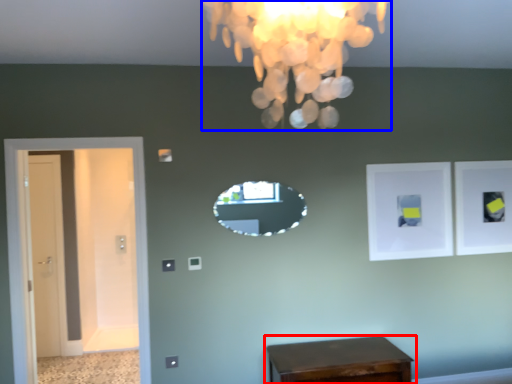
Question: Which object appears farthest to the camera in this image, table (highlighted by a red box) or lamp (highlighted by a blue box)?

Choices:
 (A) table
 (B) lamp

Answer: (A)